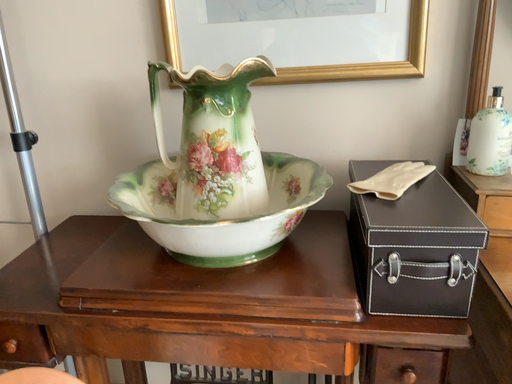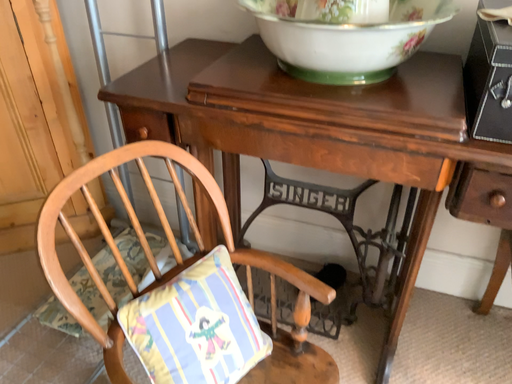
Question: How did the camera likely rotate when shooting the video?

Choices:
 (A) rotated left
 (B) rotated right

Answer: (A)